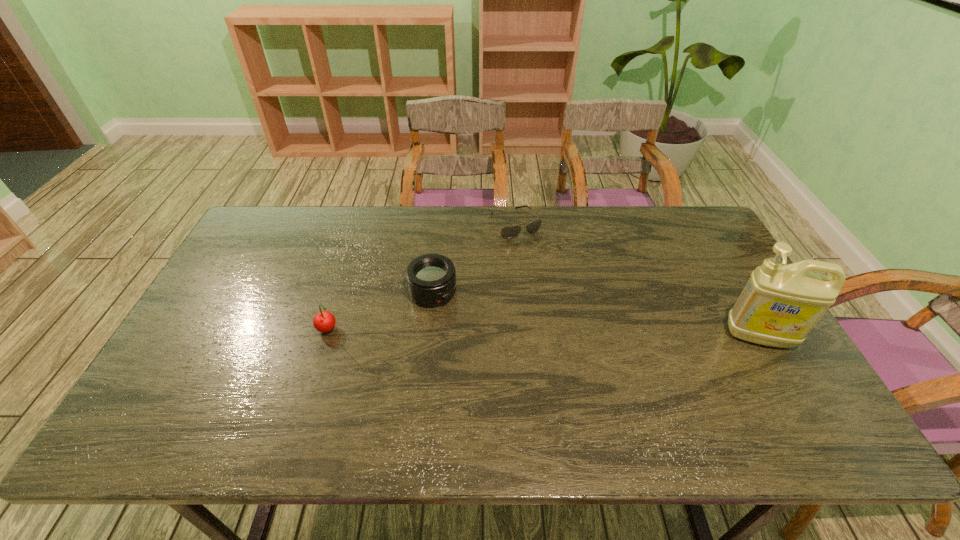
Where is `vacant space on the desktop that is between the cherry and the detergent and is positioned on the front-facing side of the shortest object`? vacant space on the desktop that is between the cherry and the detergent and is positioned on the front-facing side of the shortest object is located at coordinates (592, 334).

The width and height of the screenshot is (960, 540). What are the coordinates of `vacant space on the desktop that is between the leftmost object and the detergent and is positioned on the side of the second farthest object with brand markings and control switches` in the screenshot? It's located at coord(489,332).